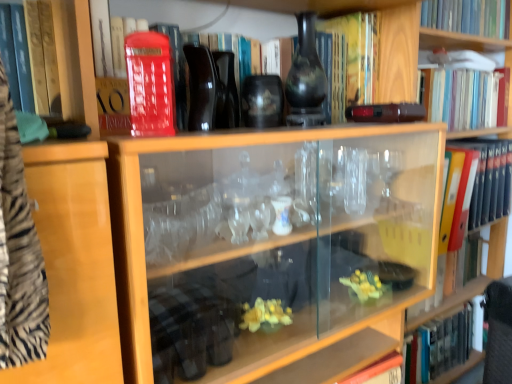
Find the location of a particular element. free space above orange file folder at right, acting as the 2th book starting from the bottom (from a real-world perspective) is located at coordinates (486, 140).